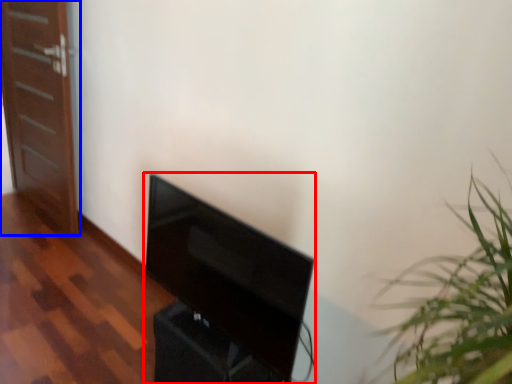
Question: Which of the following is the closest to the observer, furniture (highlighted by a red box) or door (highlighted by a blue box)?

Choices:
 (A) furniture
 (B) door

Answer: (A)